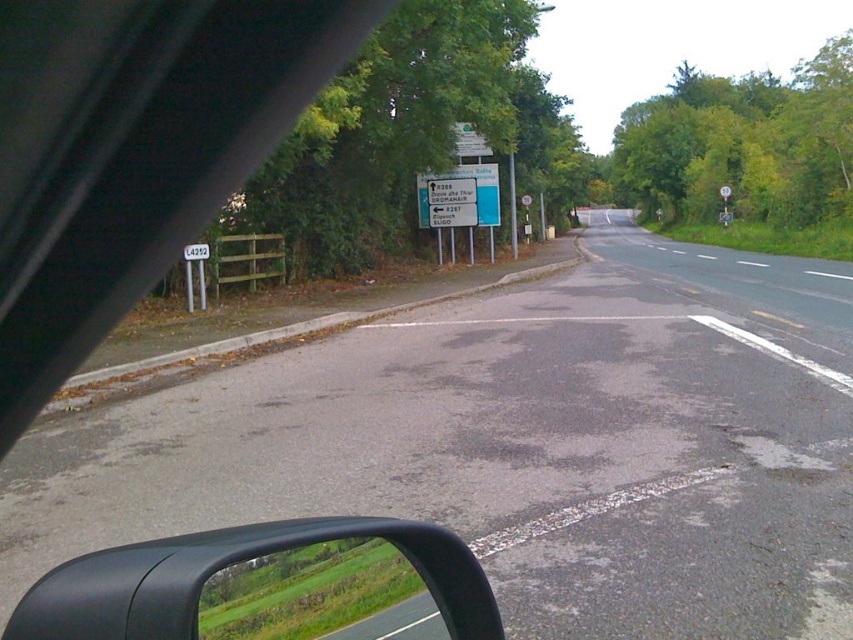
Does black rubber view mirror at lower left have a smaller size compared to green matte side mirror at lower left?

No.

Which is in front, point (286, 536) or point (277, 560)?

Point (286, 536) is in front.

Locate an element on the screen. black rubber view mirror at lower left is located at coordinates (221, 566).

Can you confirm if black rubber view mirror at lower left is bigger than white plastic sign at upper left?

Correct, black rubber view mirror at lower left is larger in size than white plastic sign at upper left.

Can you confirm if black rubber view mirror at lower left is smaller than white plastic sign at upper left?

Incorrect, black rubber view mirror at lower left is not smaller in size than white plastic sign at upper left.

Which is behind, point (163, 577) or point (190, 256)?

Positioned behind is point (190, 256).

Find the location of a particular element. This screenshot has height=640, width=853. black rubber view mirror at lower left is located at coordinates (221, 566).

Between point (349, 580) and point (193, 252), which one is positioned in front?

Point (349, 580) is in front.

Who is more forward, (397,636) or (196,252)?

Point (397,636) is in front.

At what (x,y) coordinates should I click in order to perform the action: click on green matte side mirror at lower left. Please return your answer as a coordinate pair (x, y). The height and width of the screenshot is (640, 853). Looking at the image, I should click on (321, 595).